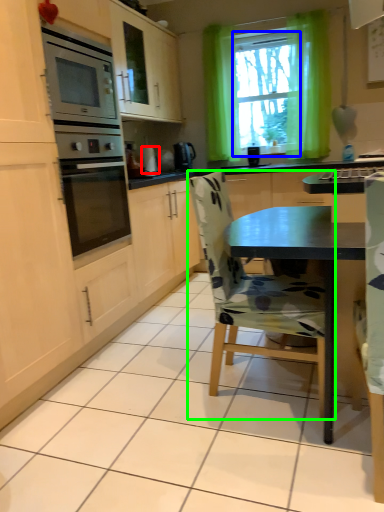
Question: Based on their relative distances, which object is nearer to appliance (highlighted by a red box)? Choose from window screen (highlighted by a blue box) and chair (highlighted by a green box).

Choices:
 (A) window screen
 (B) chair

Answer: (A)